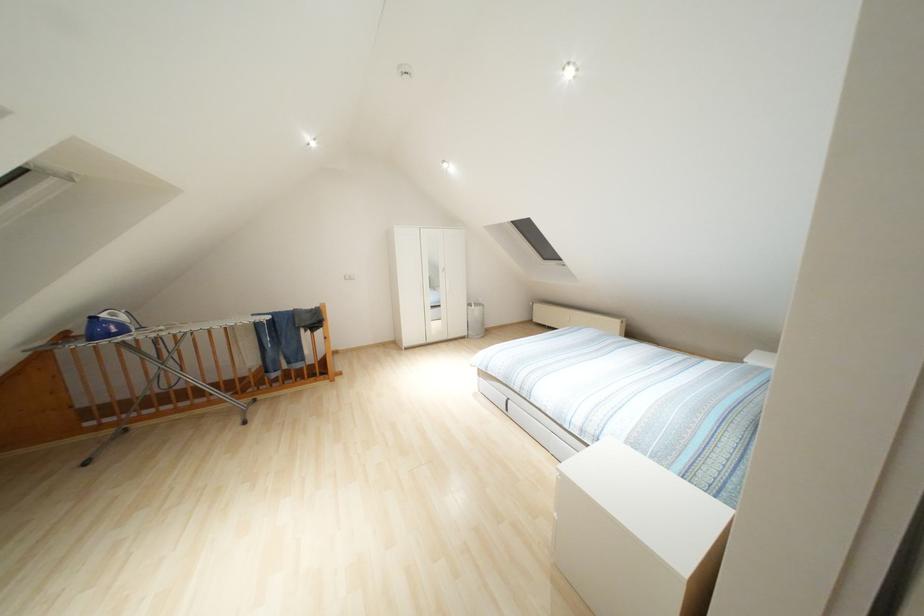
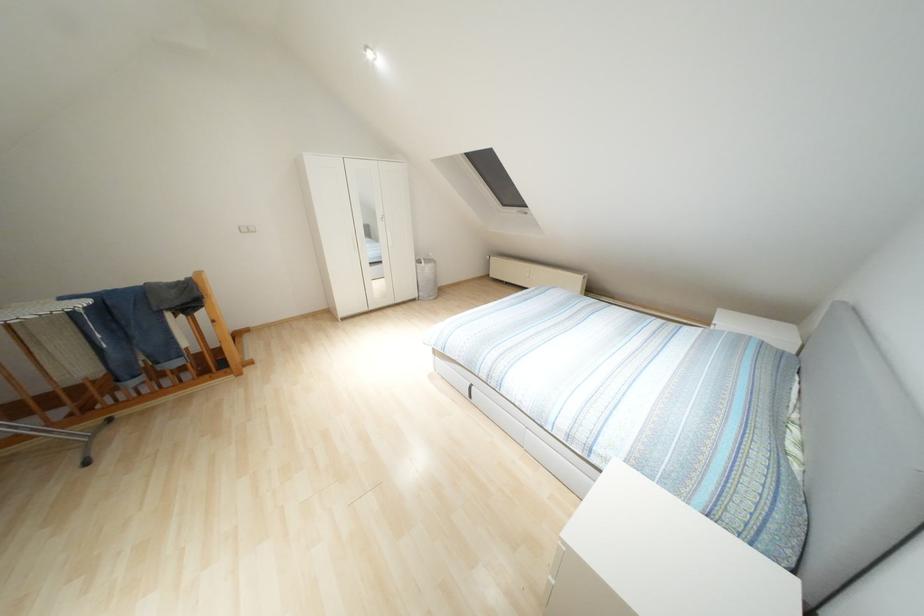
In the second image, find the point that corresponds to point (476, 310) in the first image.

(426, 268)